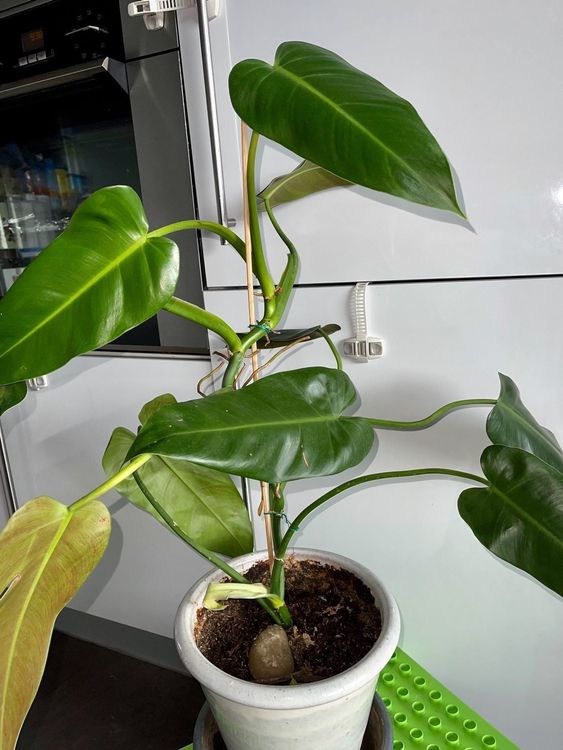
Where is `house plant`? The image size is (563, 750). house plant is located at coordinates click(x=249, y=457).